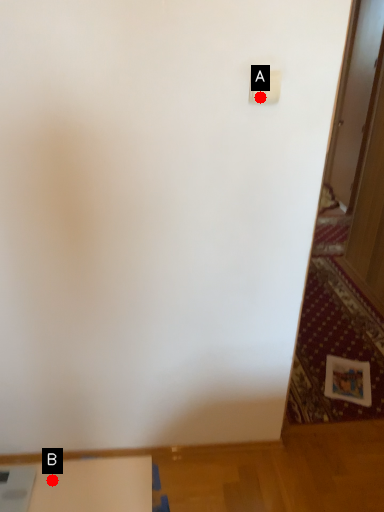
Question: Two points are circled on the image, labeled by A and B beside each circle. Which point is farther to the camera?

Choices:
 (A) A is further
 (B) B is further

Answer: (B)